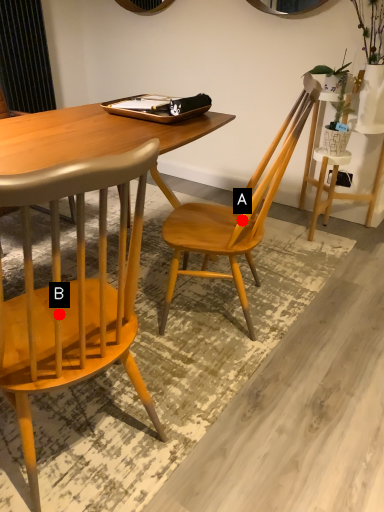
Question: Two points are circled on the image, labeled by A and B beside each circle. Which point is closer to the camera taking this photo?

Choices:
 (A) A is closer
 (B) B is closer

Answer: (B)